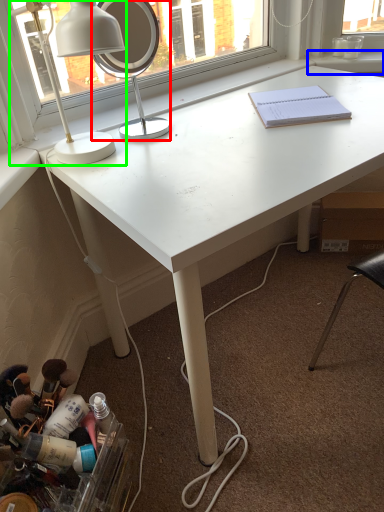
Question: Estimate the real-world distances between objects in this image. Which object is closer to mirror (highlighted by a red box), window sill (highlighted by a blue box) or lamp (highlighted by a green box)?

Choices:
 (A) window sill
 (B) lamp

Answer: (A)